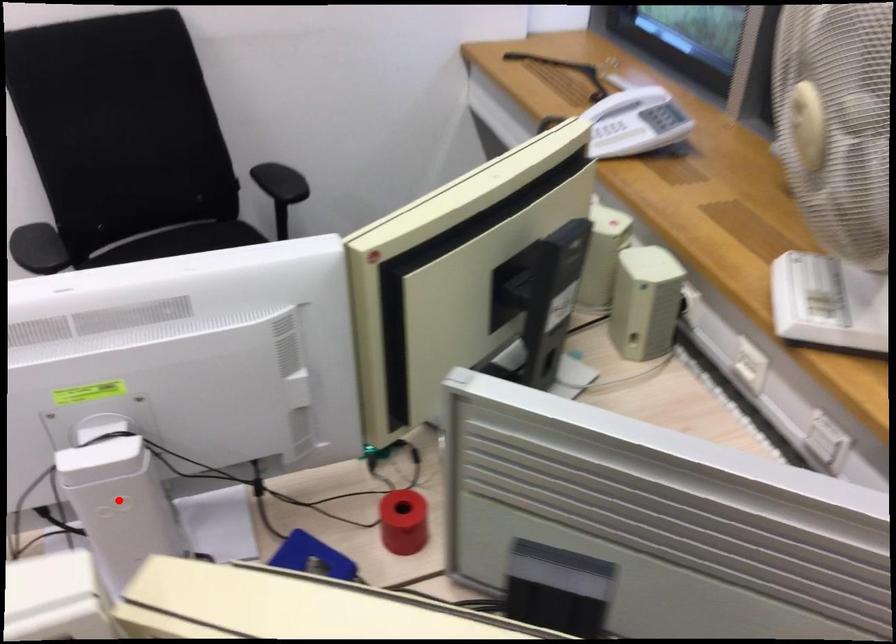
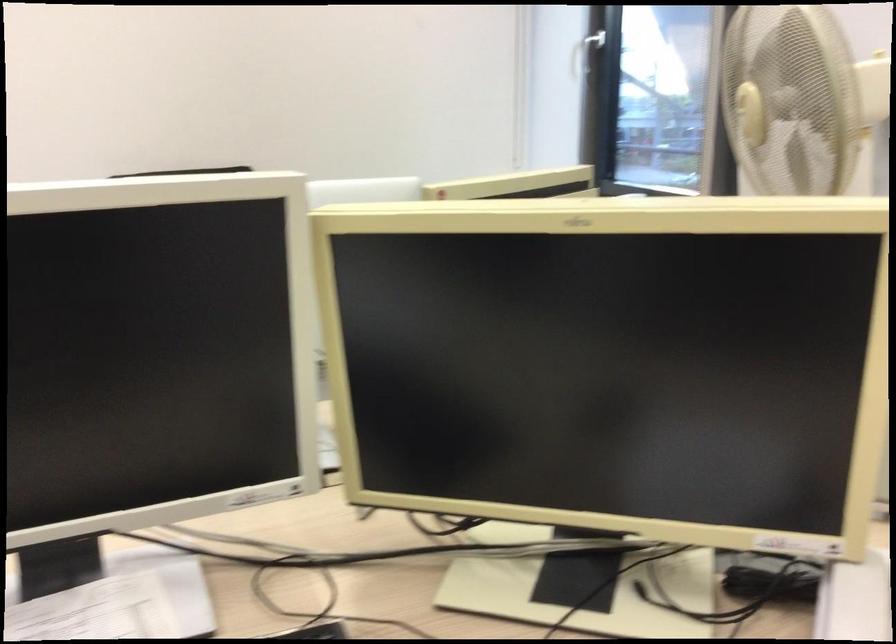
Question: I am providing you with two images of the same scene from different viewpoints. A red point is marked on the first image. Can you still see the location of the red point in image 2?

Choices:
 (A) Yes
 (B) No

Answer: (B)